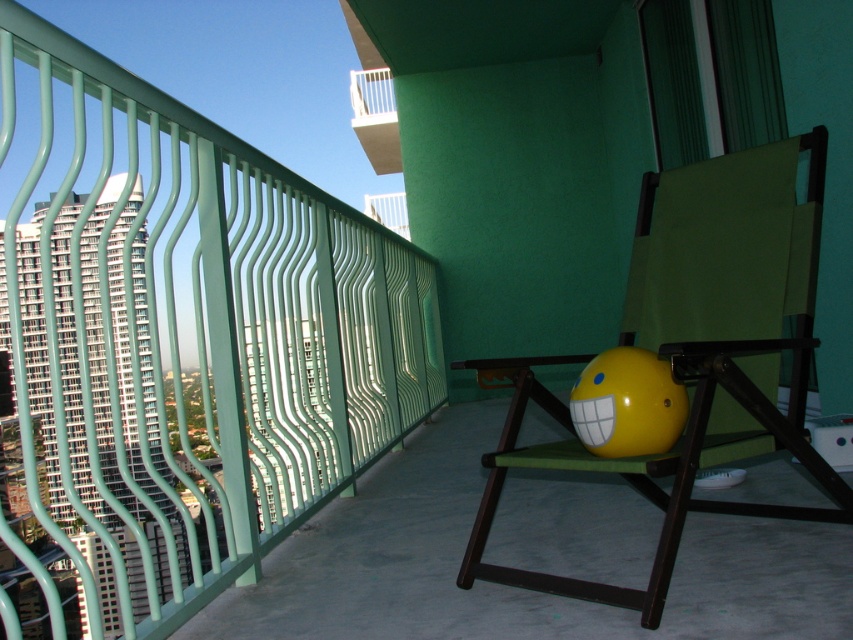
Question: Can you confirm if matte green folding chair at center is positioned to the right of white glossy balcony at upper center?

Choices:
 (A) no
 (B) yes

Answer: (B)

Question: Which of these objects is positioned farthest from the white glossy balcony at upper center?

Choices:
 (A) matte green folding chair at center
 (B) yellow matte beach ball at center

Answer: (B)

Question: Is yellow matte beach ball at center positioned before white glossy balcony at upper center?

Choices:
 (A) yes
 (B) no

Answer: (A)

Question: Can you confirm if yellow matte beach ball at center is positioned to the left of white glossy balcony at upper center?

Choices:
 (A) yes
 (B) no

Answer: (B)

Question: Based on their relative distances, which object is nearer to the white glossy balcony at upper center?

Choices:
 (A) yellow matte beach ball at center
 (B) matte green folding chair at center

Answer: (B)

Question: Which point is farther to the camera?

Choices:
 (A) (374, 96)
 (B) (589, 412)
 (C) (814, 280)

Answer: (A)